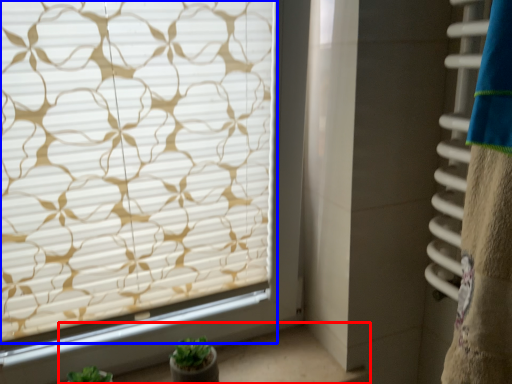
Question: Which of the following is the closest to the observer, window sill (highlighted by a red box) or window blind (highlighted by a blue box)?

Choices:
 (A) window sill
 (B) window blind

Answer: (B)